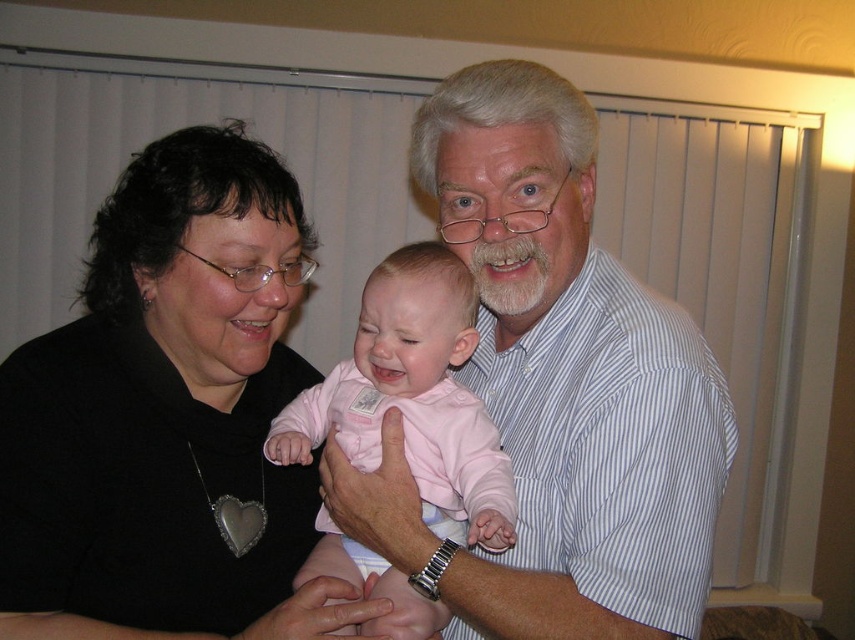
Based on the scene description, where exactly is the black fabric at center located? Please provide its coordinates.

The black fabric at center is located at point (168, 417).

You are designing a new baby carrier that needs to accommodate both the pink fabric baby at center and the white striped shirt at center. Based on the image, which object requires a wider space in the carrier?

The white striped shirt at center requires a wider space in the carrier because its width surpasses that of the pink fabric baby at center.